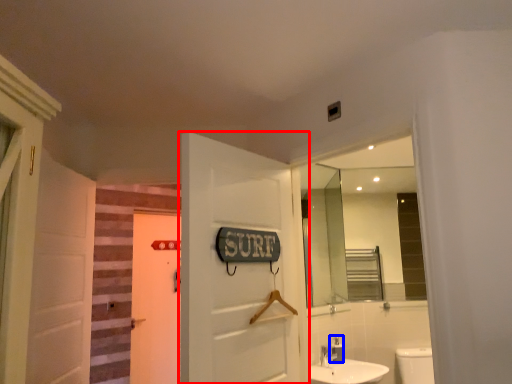
Question: Among these objects, which one is nearest to the camera, door (highlighted by a red box) or toiletry (highlighted by a blue box)?

Choices:
 (A) door
 (B) toiletry

Answer: (A)